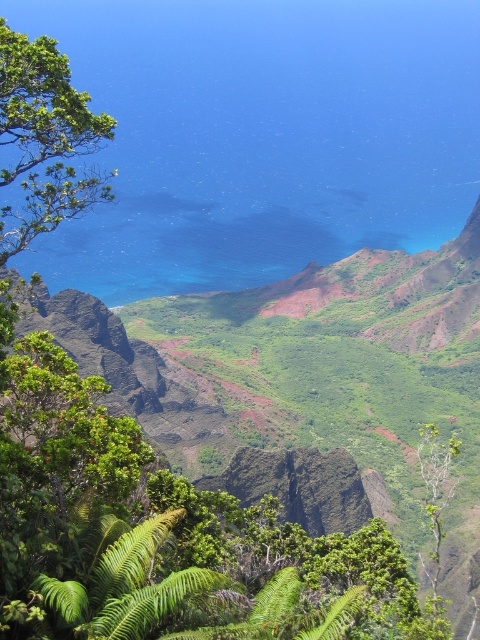
Can you confirm if blue water at center is bigger than green leafy tree at upper left?

Yes.

In the scene shown: Who is more forward, (136,68) or (58,179)?

Positioned in front is point (58,179).

Locate an element on the screen. This screenshot has height=640, width=480. blue water at center is located at coordinates (263, 134).

I want to click on blue water at center, so click(263, 134).